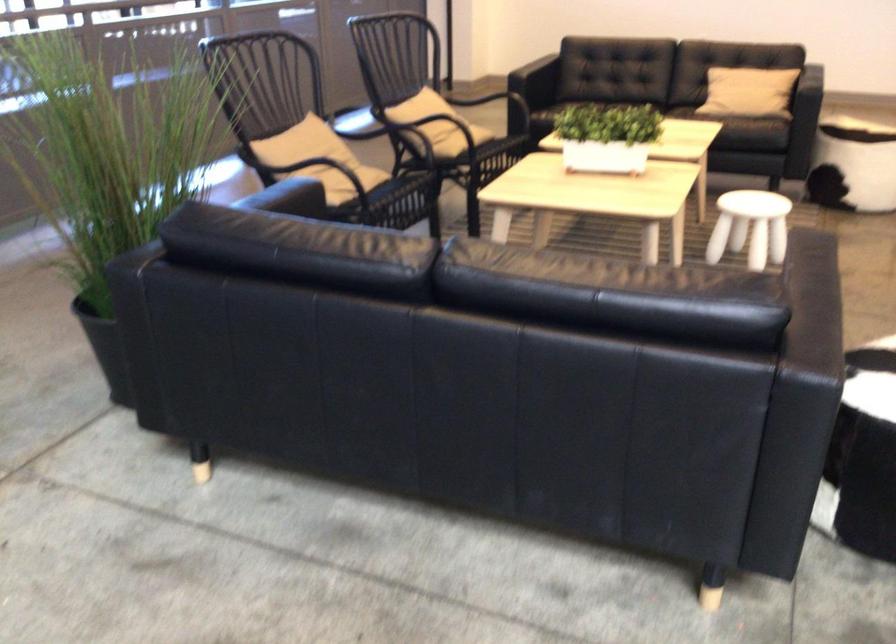
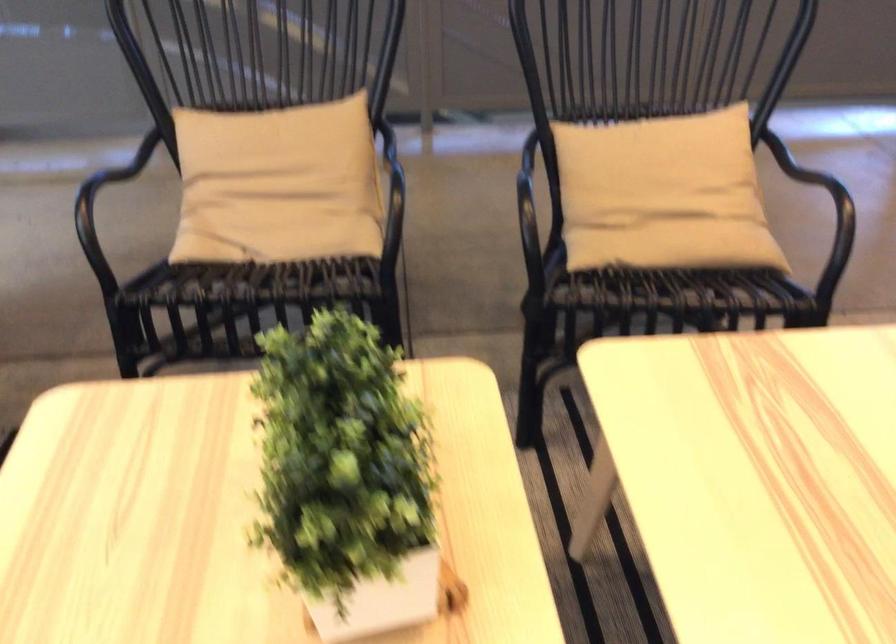
In the second image, find the point that corresponds to the point at 481,131 in the first image.

(674, 245)